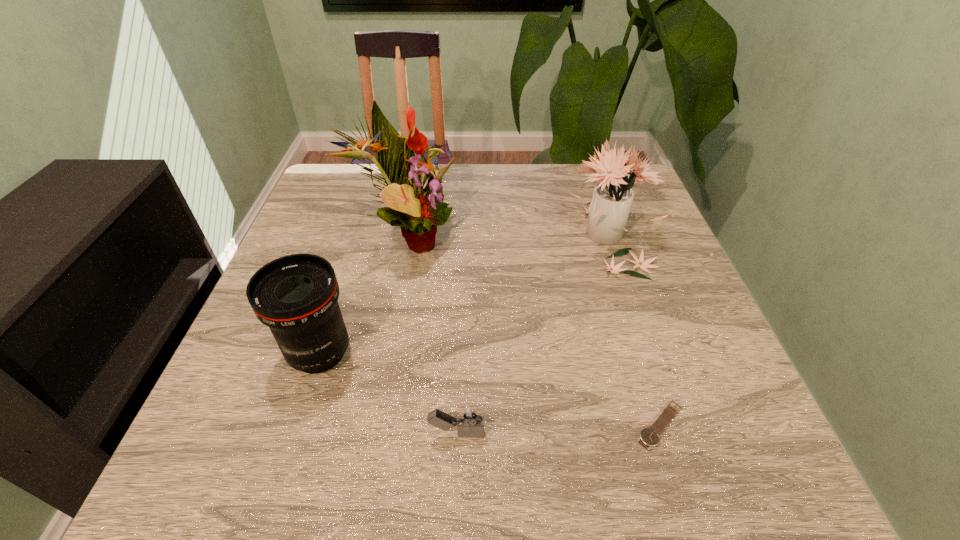
Where is `object located at the far right corner`? This screenshot has height=540, width=960. object located at the far right corner is located at coordinates (609, 209).

Locate an element on the screen. object present at the near right corner is located at coordinates (649, 437).

You are a GUI agent. You are given a task and a screenshot of the screen. Output one action in this format:
    pyautogui.click(x=<x>, y=<y>)
    Task: Click on the vacant space at the far edge of the desktop
    
    Given the screenshot: What is the action you would take?
    pyautogui.click(x=548, y=187)

Where is `free space at the near edge of the desktop`? The width and height of the screenshot is (960, 540). free space at the near edge of the desktop is located at coordinates (475, 491).

I want to click on vacant space at the left edge of the desktop, so (320, 215).

You are a GUI agent. You are given a task and a screenshot of the screen. Output one action in this format:
    pyautogui.click(x=<x>, y=<y>)
    Task: Click on the free space at the right edge
    The width and height of the screenshot is (960, 540).
    Given the screenshot: What is the action you would take?
    pyautogui.click(x=646, y=255)

This screenshot has width=960, height=540. Find the location of `empty space that is in between the shorter bouquet and the tallest object`. empty space that is in between the shorter bouquet and the tallest object is located at coordinates (508, 237).

Identify the location of free space between the igniter and the telephoto lens. (389, 394).

Locate an element on the screen. This screenshot has width=960, height=540. free space between the second shortest object and the fourth shortest object is located at coordinates (533, 334).

In order to click on vacant area between the third farthest object and the fourth tallest object in this screenshot , I will do `click(389, 394)`.